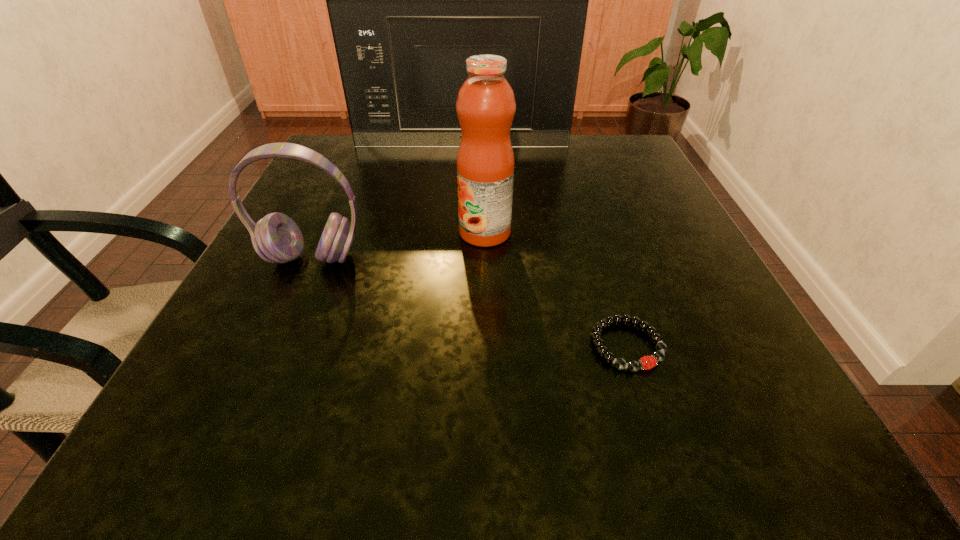
You are a GUI agent. You are given a task and a screenshot of the screen. Output one action in this format:
    pyautogui.click(x=<x>, y=<y>)
    Task: Click on the free point located on the right of the shortest object
    
    Given the screenshot: What is the action you would take?
    pyautogui.click(x=751, y=346)

Identify the location of object present at the far edge. (409, 0).

Image resolution: width=960 pixels, height=540 pixels. What are the coordinates of `microwave oven positioned at the left edge` in the screenshot? It's located at (409, 0).

At what (x,y) coordinates should I click in order to perform the action: click on headset located in the left edge section of the desktop. Please return your answer as a coordinate pair (x, y). This screenshot has height=540, width=960. Looking at the image, I should click on (276, 238).

Locate an element on the screen. This screenshot has height=540, width=960. object at the right edge is located at coordinates (647, 362).

Where is `object that is positioned at the far left corner`? Image resolution: width=960 pixels, height=540 pixels. object that is positioned at the far left corner is located at coordinates (409, 0).

In the image, there is a desktop. At what (x,y) coordinates should I click in order to perform the action: click on vacant space at the far edge. Please return your answer as a coordinate pair (x, y). The width and height of the screenshot is (960, 540). Looking at the image, I should click on (534, 173).

I want to click on vacant space at the near edge of the desktop, so click(x=513, y=423).

This screenshot has height=540, width=960. Identify the location of free space at the left edge. (292, 395).

In order to click on free space at the right edge of the desktop in this screenshot , I will do `click(643, 231)`.